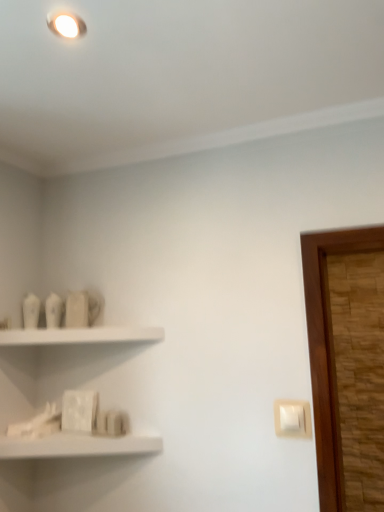
Question: Does white plastic light switch at lower right have a greater height compared to white matte shelf at lower left, which is the 2th shelf from top to bottom?

Choices:
 (A) no
 (B) yes

Answer: (B)

Question: Is white plastic light switch at lower right smaller than white matte shelf at lower left, the first shelf when ordered from bottom to top?

Choices:
 (A) no
 (B) yes

Answer: (B)

Question: Considering the relative positions of white plastic light switch at lower right and white matte shelf at lower left, the first shelf when ordered from bottom to top, in the image provided, is white plastic light switch at lower right behind white matte shelf at lower left, the first shelf when ordered from bottom to top,?

Choices:
 (A) yes
 (B) no

Answer: (A)

Question: From the image's perspective, is white plastic light switch at lower right located beneath white matte shelf at lower left, which is the 2th shelf from top to bottom?

Choices:
 (A) no
 (B) yes

Answer: (A)

Question: Considering the relative positions of white plastic light switch at lower right and white matte shelf at lower left, which is the 2th shelf from top to bottom, in the image provided, is white plastic light switch at lower right to the right of white matte shelf at lower left, which is the 2th shelf from top to bottom, from the viewer's perspective?

Choices:
 (A) yes
 (B) no

Answer: (A)

Question: From a real-world perspective, is white matte shelf at upper left, placed as the second shelf when sorted from bottom to top, positioned above or below white plastic light switch at lower right?

Choices:
 (A) below
 (B) above

Answer: (B)

Question: Considering the positions of white matte shelf at upper left, placed as the second shelf when sorted from bottom to top, and white plastic light switch at lower right in the image, is white matte shelf at upper left, placed as the second shelf when sorted from bottom to top, bigger or smaller than white plastic light switch at lower right?

Choices:
 (A) big
 (B) small

Answer: (A)

Question: Considering their positions, is white matte shelf at upper left, the 1th shelf in the top-to-bottom sequence, located in front of or behind white plastic light switch at lower right?

Choices:
 (A) front
 (B) behind

Answer: (B)

Question: Would you say white matte shelf at upper left, the 1th shelf in the top-to-bottom sequence, is inside or outside white plastic light switch at lower right?

Choices:
 (A) inside
 (B) outside

Answer: (B)

Question: Is white plastic light switch at lower right taller or shorter than white matte shelf at upper left, placed as the second shelf when sorted from bottom to top?

Choices:
 (A) short
 (B) tall

Answer: (B)

Question: Is point (289, 420) closer or farther from the camera than point (84, 340)?

Choices:
 (A) closer
 (B) farther

Answer: (A)

Question: Considering the positions of white plastic light switch at lower right and white matte shelf at upper left, the 1th shelf in the top-to-bottom sequence, in the image, is white plastic light switch at lower right bigger or smaller than white matte shelf at upper left, the 1th shelf in the top-to-bottom sequence,?

Choices:
 (A) small
 (B) big

Answer: (A)

Question: Is white plastic light switch at lower right in front of or behind white matte shelf at upper left, the 1th shelf in the top-to-bottom sequence, in the image?

Choices:
 (A) front
 (B) behind

Answer: (A)

Question: Would you say white matte shelf at lower left, which is the 2th shelf from top to bottom, is to the left or to the right of white matte shelf at upper left, placed as the second shelf when sorted from bottom to top, in the picture?

Choices:
 (A) left
 (B) right

Answer: (A)

Question: Choose the correct answer: Is white matte shelf at lower left, the first shelf when ordered from bottom to top, inside white matte shelf at upper left, the 1th shelf in the top-to-bottom sequence, or outside it?

Choices:
 (A) outside
 (B) inside

Answer: (A)